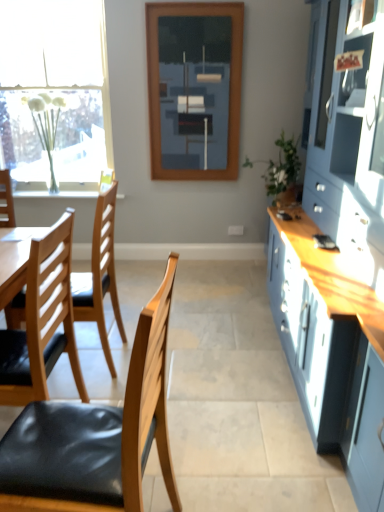
Question: Considering the positions of point (185, 50) and point (370, 93), is point (185, 50) closer or farther from the camera than point (370, 93)?

Choices:
 (A) closer
 (B) farther

Answer: (B)

Question: Would you say wooden frame at center is to the left or to the right of matte blue cabinet at right in the picture?

Choices:
 (A) right
 (B) left

Answer: (B)

Question: Which object is positioned farthest from the wooden frame at center?

Choices:
 (A) green leafy plant at right
 (B) white frosted glass vase at left
 (C) white sheer curtain at left
 (D) matte blue cabinet at right
 (E) wooden chair with black seat cushion at left, the first chair positioned from the back

Answer: (E)

Question: Considering the real-world distances, which object is closest to the wooden chair with black seat cushion at left, which appears as the 2th chair when viewed from the front?

Choices:
 (A) white frosted glass vase at left
 (B) wooden frame at center
 (C) white sheer curtain at left
 (D) matte blue cabinet at right
 (E) black glossy mobile phone at right

Answer: (D)